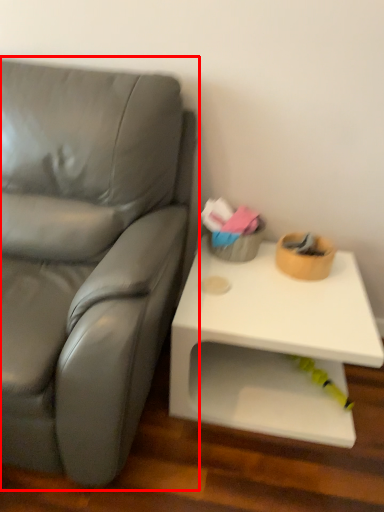
Question: From the image's perspective, what is the correct spatial positioning of studio couch (annotated by the red box) in reference to table?

Choices:
 (A) below
 (B) above

Answer: (B)